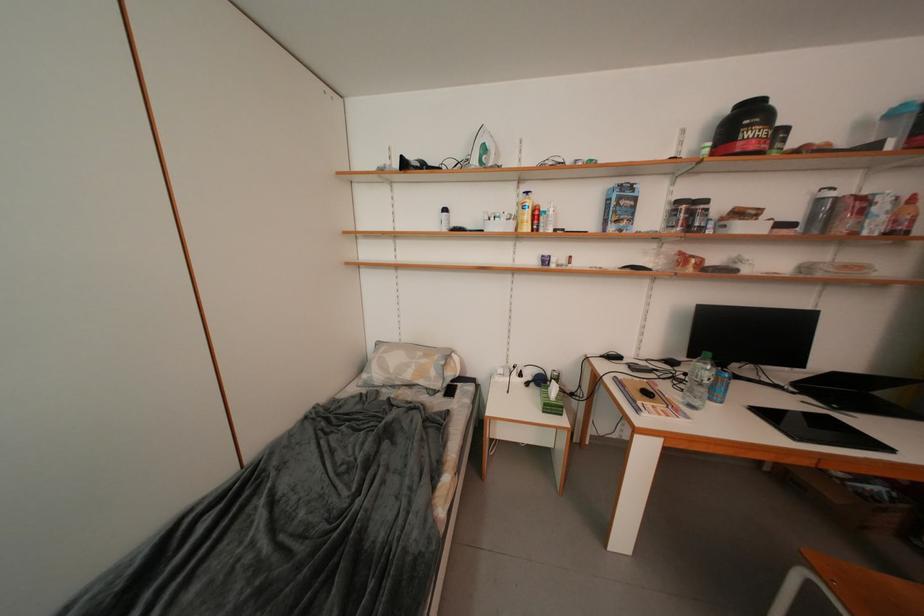
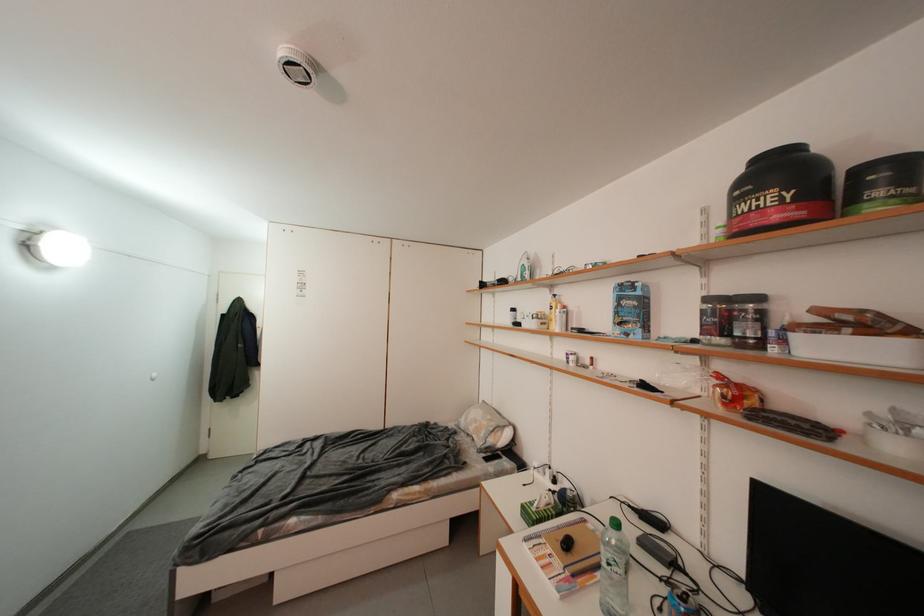
Where in the second image is the point corresponding to pixel 553 408 from the first image?

(530, 509)